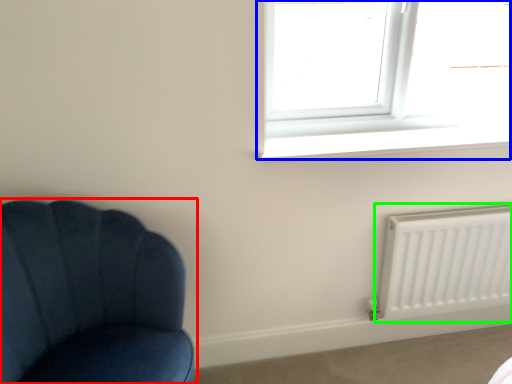
Question: Which object is the closest to the chair (highlighted by a red box)? Choose among these: window (highlighted by a blue box) or radiator (highlighted by a green box).

Choices:
 (A) window
 (B) radiator

Answer: (A)